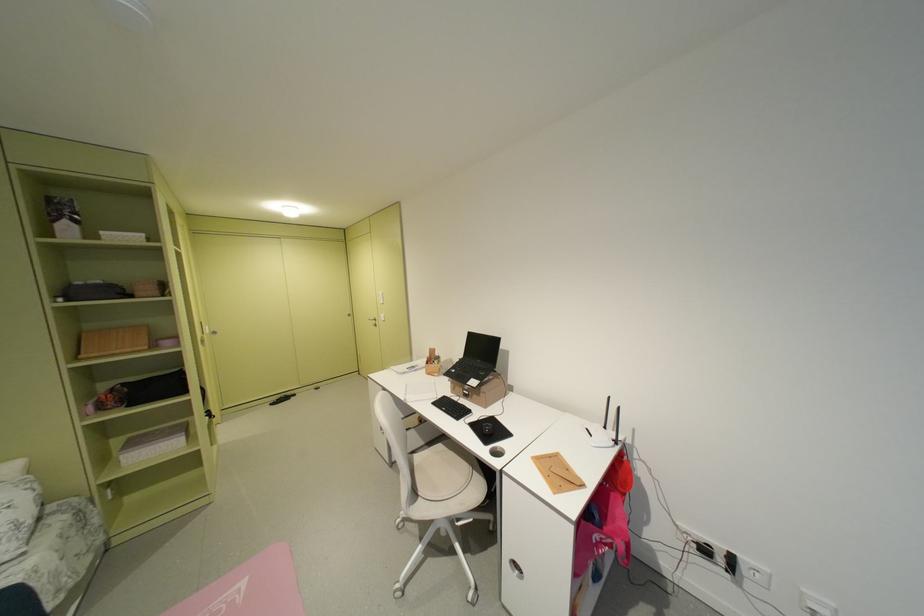
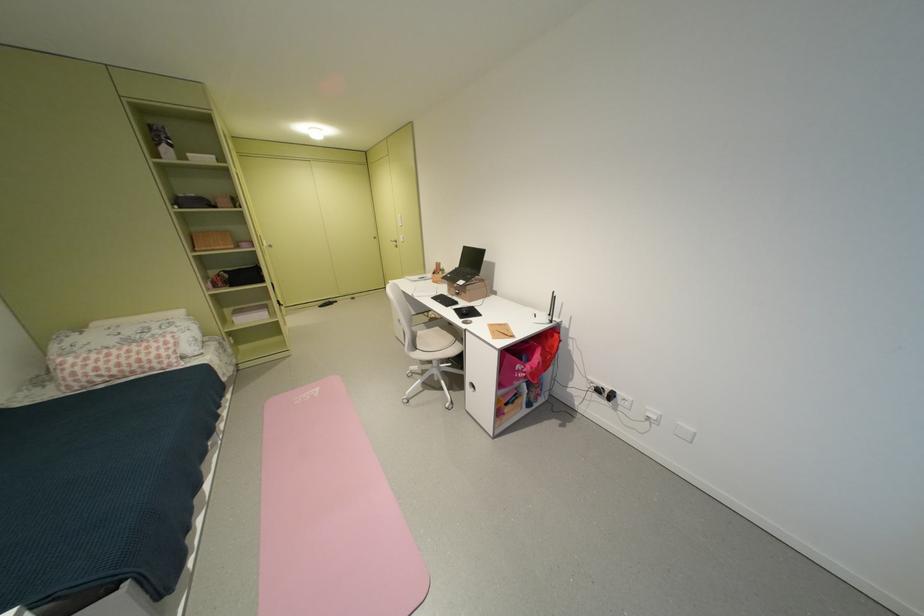
Locate, in the second image, the point that corresponds to point (468, 421) in the first image.

(456, 307)